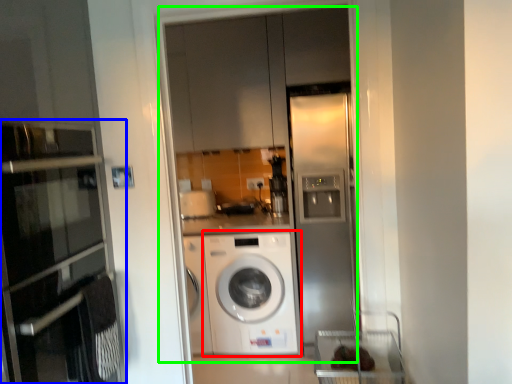
Question: Based on their relative distances, which object is nearer to washing machine (highlighted by a red box)? Choose from oven (highlighted by a blue box) and glass door (highlighted by a green box).

Choices:
 (A) oven
 (B) glass door

Answer: (B)